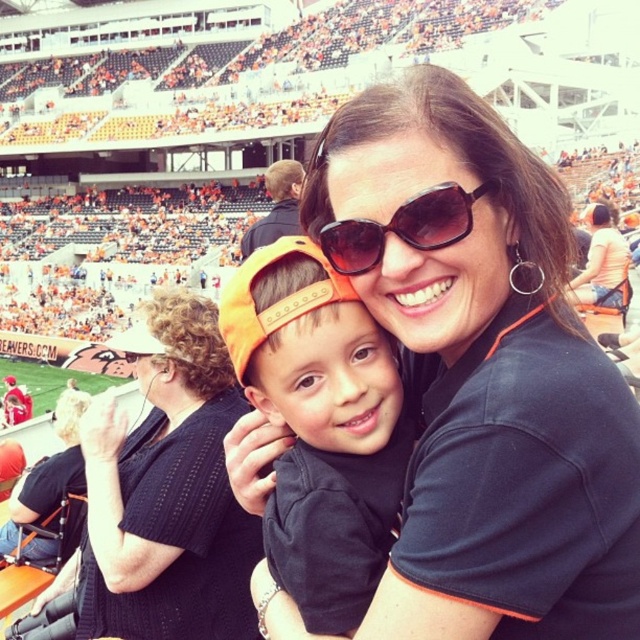
You are a photographer standing at the edge of the baseball stadium field. You want to take a photo of the black fabric shirt at center and the black plastic sunglasses at center so that both are in the frame. Given that your camera has a maximum focus range of 5 meters, will you be able to capture both objects in the same photo?

The black fabric shirt at center and black plastic sunglasses at center are 4.68 meters apart from each other. Since the distance between them is within the camera maximum focus range of 5 meters, you can capture both objects in the same photo.

You are a vendor at the baseball stadium and need to place a rectangular box that is 1 meter wide between the black knit sweater at upper left and the orange fabric cap at center. Can the box fit between them based on their widths?

The black knit sweater at upper left is wider than the orange fabric cap at center. Since the box is 1 meter wide, it depends on the combined width of both objects. However, the description only states the sweater is wider, not the exact dimensions. Without knowing the exact widths, we cannot confirm if the box will fit.